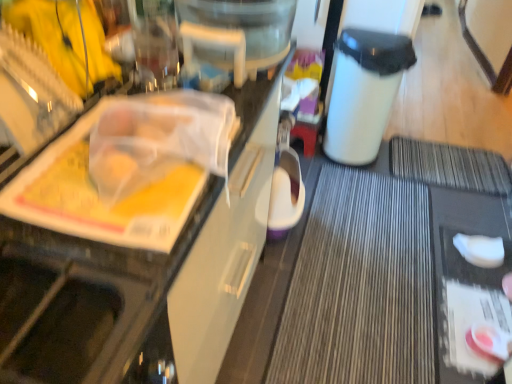
Where is `vacant point to the left of pink glossy jar at lower right, marked as the first food in a front-to-back arrangement`? The height and width of the screenshot is (384, 512). vacant point to the left of pink glossy jar at lower right, marked as the first food in a front-to-back arrangement is located at coordinates point(459,352).